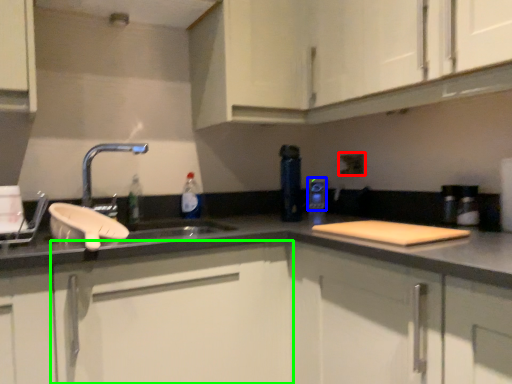
Question: Which object is positioned farthest from electric outlet (highlighted by a red box)? Select from appliance (highlighted by a blue box) and cabinetry (highlighted by a green box).

Choices:
 (A) appliance
 (B) cabinetry

Answer: (B)